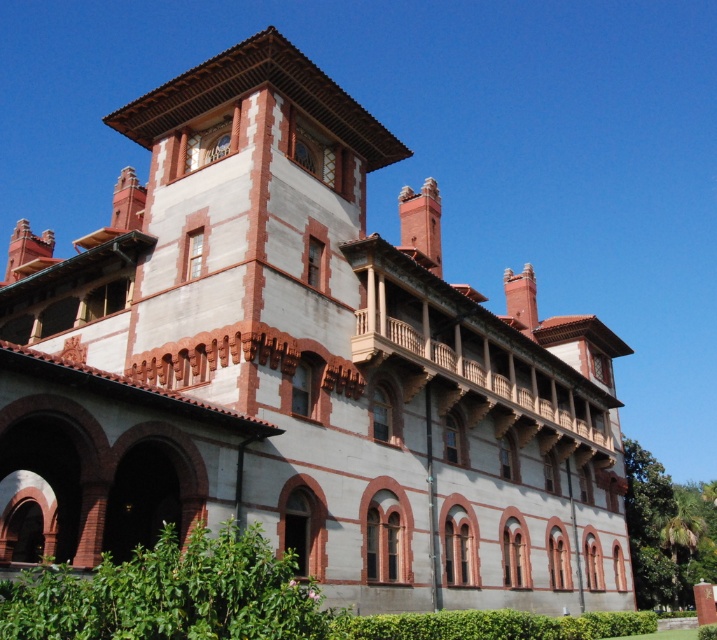
Question: Can you confirm if green leafy hedge at lower left is thinner than green leafy hedge at lower center?

Choices:
 (A) no
 (B) yes

Answer: (B)

Question: Which object is closer to the camera taking this photo?

Choices:
 (A) green leafy hedge at lower left
 (B) green leafy hedge at lower center

Answer: (A)

Question: Is green leafy hedge at lower left in front of green leafy hedge at lower center?

Choices:
 (A) no
 (B) yes

Answer: (B)

Question: Which point is closer to the camera?

Choices:
 (A) green leafy hedge at lower left
 (B) green leafy hedge at lower center

Answer: (A)

Question: Is green leafy hedge at lower left to the left of green leafy hedge at lower center from the viewer's perspective?

Choices:
 (A) no
 (B) yes

Answer: (B)

Question: Which point is farther from the camera taking this photo?

Choices:
 (A) tap(246, 531)
 (B) tap(597, 625)

Answer: (B)